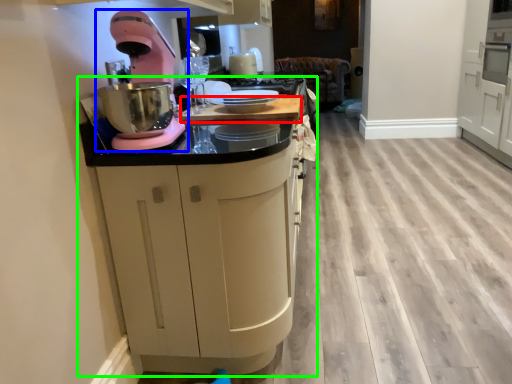
Question: Which object is the closest to the counter top (highlighted by a red box)? Choose among these: home appliance (highlighted by a blue box) or cabinetry (highlighted by a green box).

Choices:
 (A) home appliance
 (B) cabinetry

Answer: (A)